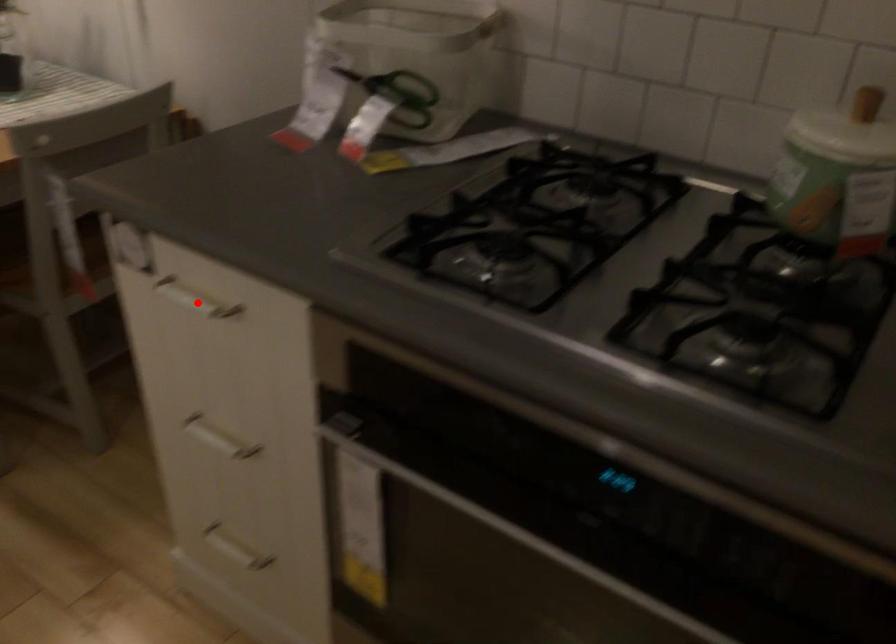
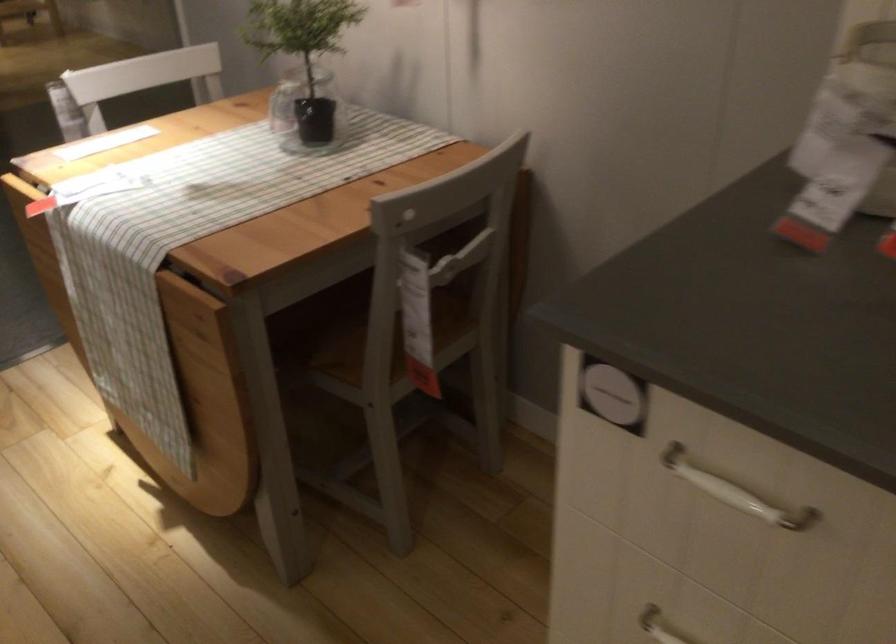
Find the pixel in the second image that matches the highlighted location in the first image.

(734, 491)